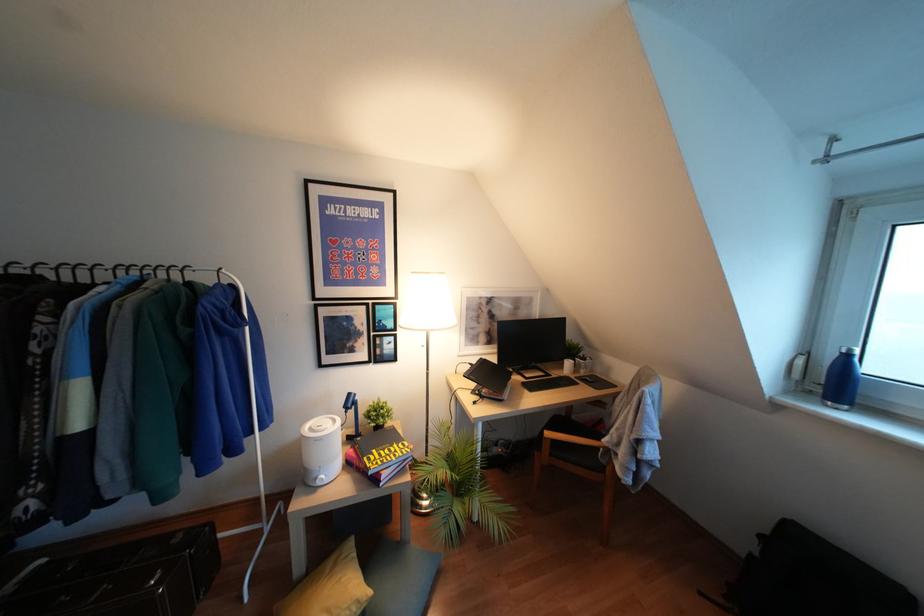
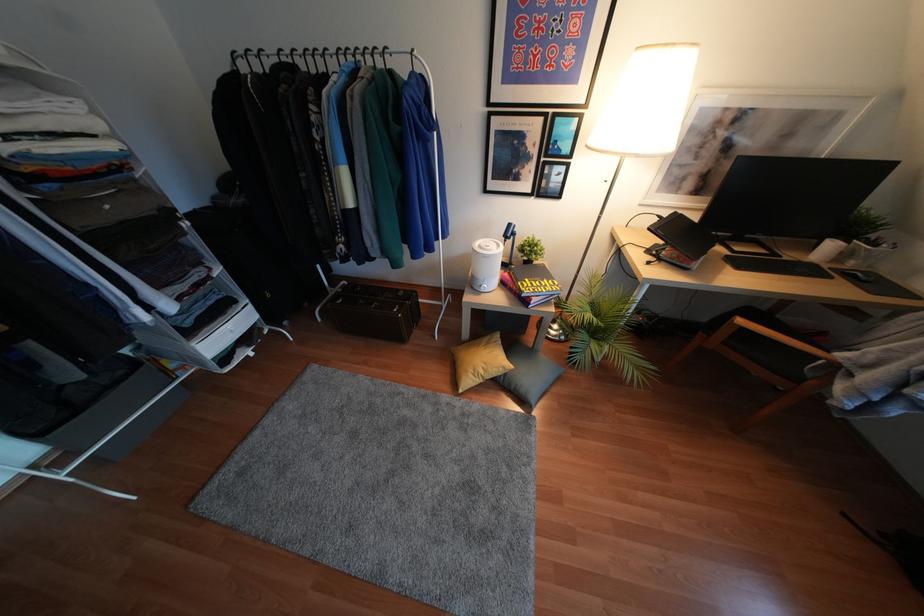
The point at (319,483) is marked in the first image. Where is the corresponding point in the second image?

(481, 290)